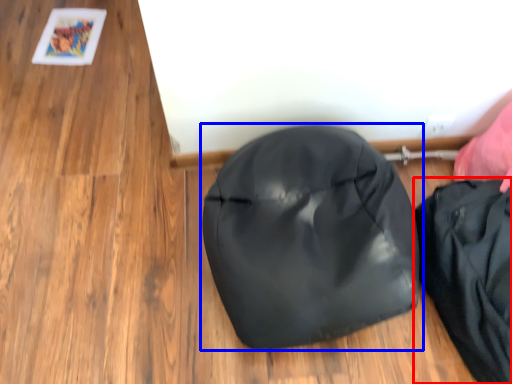
Question: Which of the following is the closest to the observer, pouch (highlighted by a red box) or footwear (highlighted by a blue box)?

Choices:
 (A) pouch
 (B) footwear

Answer: (B)